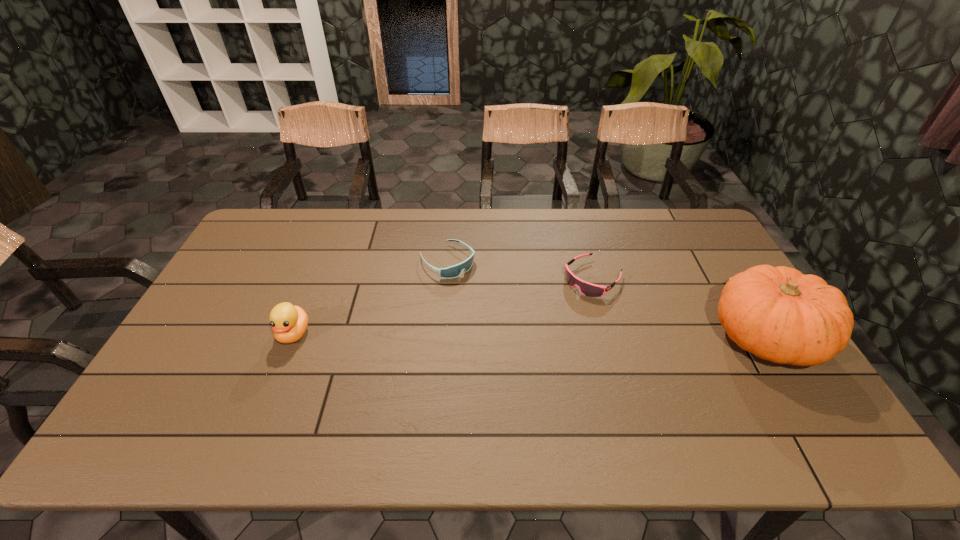
Locate an element on the screen. This screenshot has width=960, height=540. free space on the desktop that is between the second tallest object and the tallest object and is positioned on the front-facing side of the third object from right to left is located at coordinates (532, 335).

The height and width of the screenshot is (540, 960). Find the location of `vacant space on the desktop that is between the duckling and the pumpkin and is positioned on the front-facing side of the right goggles`. vacant space on the desktop that is between the duckling and the pumpkin and is positioned on the front-facing side of the right goggles is located at coordinates (524, 335).